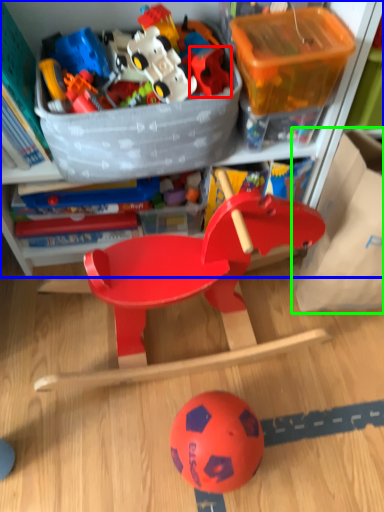
Question: Based on their relative distances, which object is nearer to toy (highlighted by a red box)? Choose from cabinetry (highlighted by a blue box) and storage box (highlighted by a green box).

Choices:
 (A) cabinetry
 (B) storage box

Answer: (A)